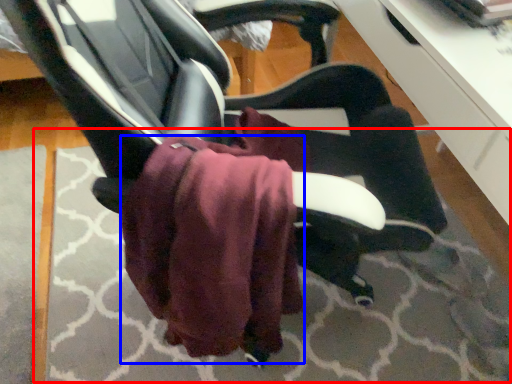
Question: Which object is closer to the camera taking this photo, mat (highlighted by a red box) or bath towel (highlighted by a blue box)?

Choices:
 (A) mat
 (B) bath towel

Answer: (B)